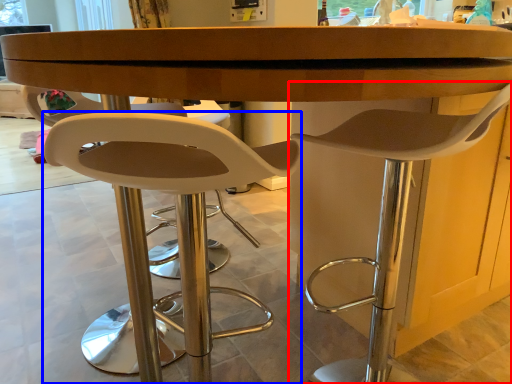
Question: Which object is closer to the camera taking this photo, chair (highlighted by a red box) or chair (highlighted by a blue box)?

Choices:
 (A) chair
 (B) chair

Answer: (B)